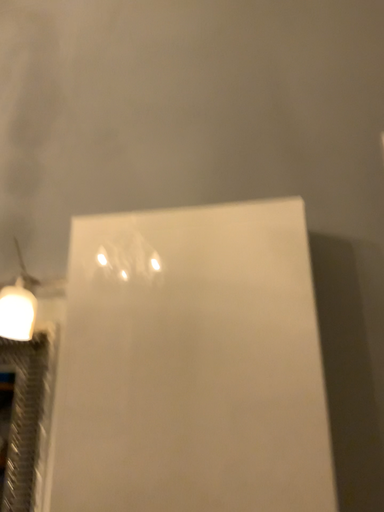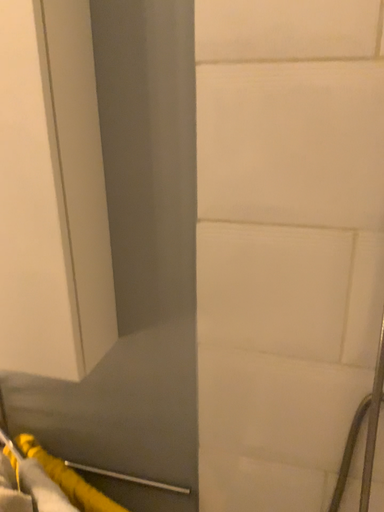
Question: Which way did the camera rotate in the video?

Choices:
 (A) rotated downward
 (B) rotated upward

Answer: (A)